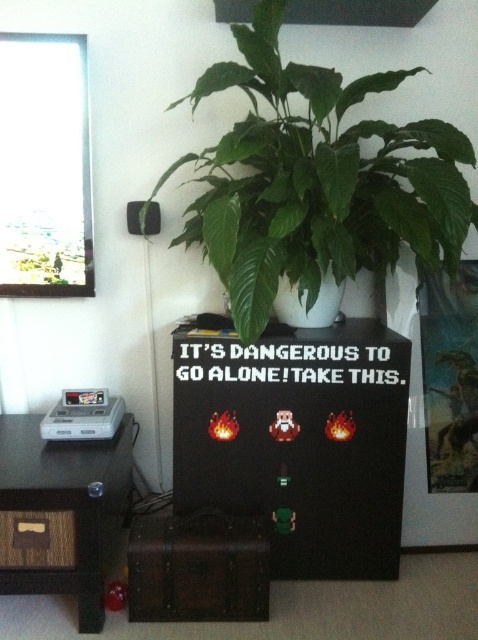
You are setting up a new lamp in the room. You have a tall floor lamp that needs to be placed between the brushed wood table at left and the black matte speaker at upper left. Is there enough vertical space between them to place the lamp?

The brushed wood table at left is positioned under the black matte speaker at upper left, so there is enough vertical space between them to place the tall floor lamp.

You are a visitor in this room and want to place a new item between the green leafy plant at upper center and the black matte speaker at upper left. Is there enough vertical space between them to fit a 10 cm tall item?

The green leafy plant at upper center is located above the black matte speaker at upper left, but the exact vertical distance between them isn not specified. Without knowing the vertical space, it is uncertain if a 10 cm tall item can fit between them.

You are standing in the room and want to place a small item on the closest point between point [72,506] and point [43,426]. Which point should you choose?

Point [72,506] is in front of point [43,426], so the closest point to you would be point [72,506]. Place your item there.